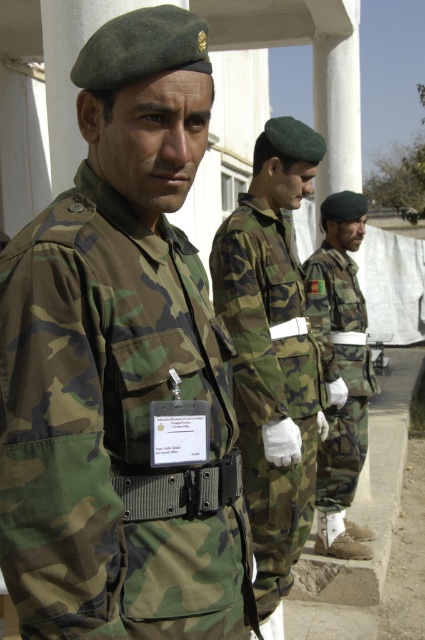
You are a photographer trying to capture a group photo of the camouflage fabric uniform at center and the camo fabric uniform at center. Which one should you position to the left side of the photo to match their current arrangement?

You should position the camouflage fabric uniform at center to the left side of the photo because it is already to the left of the camo fabric uniform at center in the current arrangement.

You are a photographer trying to capture a clear shot of the camouflage fabric uniform at center and the camo fabric uniform at center. Which one should you focus on to ensure it appears sharp in the photo?

The camouflage fabric uniform at center is closer to the viewer than the camo fabric uniform at center, so focusing on it will ensure it appears sharp in the photo.